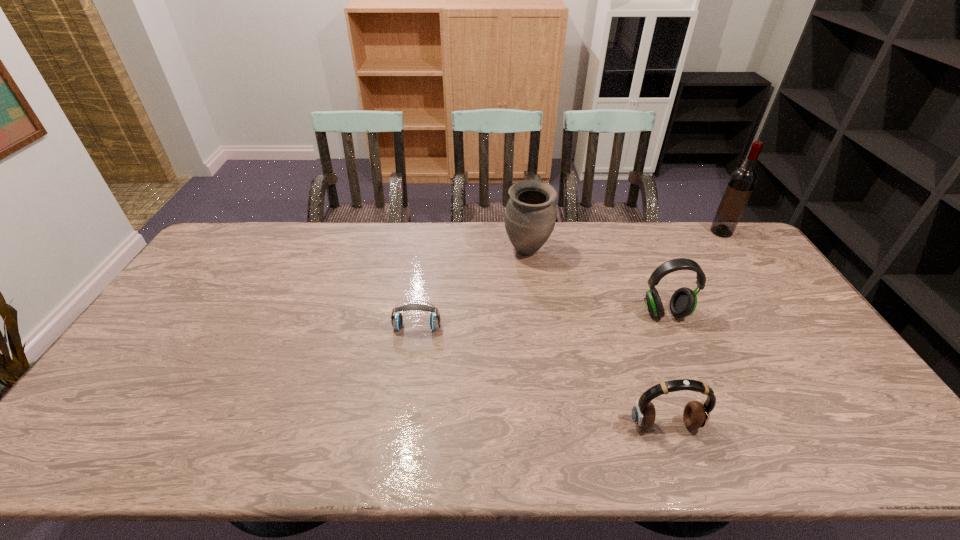
This screenshot has width=960, height=540. What are the coordinates of `unoccupied position between the nearest headset and the fourth shortest object` in the screenshot? It's located at (596, 338).

Find the location of a particular element. This screenshot has width=960, height=540. free point between the second tallest object and the leftmost object is located at coordinates (472, 289).

This screenshot has height=540, width=960. Identify the location of vacant area that lies between the nearest headset and the fourth shortest object. (596, 338).

The height and width of the screenshot is (540, 960). In order to click on free space that is in between the nearest object and the shortest headset in this screenshot , I will do `click(541, 376)`.

Identify which object is the nearest to the nearest headset. Please provide its 2D coordinates. Your answer should be formatted as a tuple, i.e. [(x, y)], where the tuple contains the x and y coordinates of a point satisfying the conditions above.

[(683, 302)]

Find the location of a particular element. The width and height of the screenshot is (960, 540). object identified as the closest to the second shortest object is located at coordinates (683, 302).

Select which headset is the second closest to the rightmost object. Please provide its 2D coordinates. Your answer should be formatted as a tuple, i.e. [(x, y)], where the tuple contains the x and y coordinates of a point satisfying the conditions above.

[(696, 414)]

What are the coordinates of `headset that is the closest to the tallest object` in the screenshot? It's located at (683, 302).